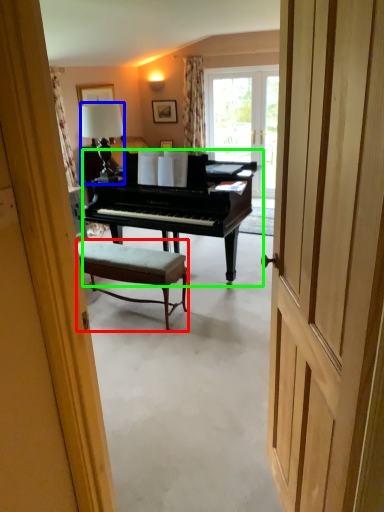
Question: Which object is the closest to the stool (highlighted by a red box)? Choose among these: lamp (highlighted by a blue box) or piano (highlighted by a green box).

Choices:
 (A) lamp
 (B) piano

Answer: (B)